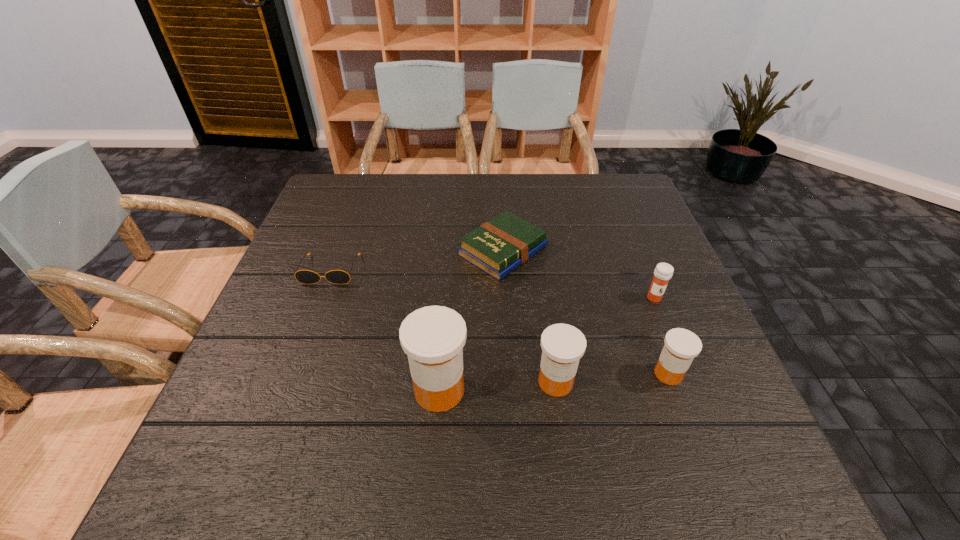
Identify the location of vacant region between the sunglasses and the farthest medicine. [x=492, y=284].

The image size is (960, 540). In order to click on unoccupied position between the tallest object and the book in this screenshot , I will do `click(471, 320)`.

Locate an element on the screen. free spot between the tallest medicine and the book is located at coordinates (471, 320).

Identify the location of empty location between the second tallest medicine and the book. The height and width of the screenshot is (540, 960). (529, 316).

Where is `object that is the third closest to the sunglasses`? The image size is (960, 540). object that is the third closest to the sunglasses is located at coordinates (563, 345).

Find the location of a particular element. object identified as the fourth closest to the book is located at coordinates (303, 276).

Locate an element on the screen. This screenshot has height=540, width=960. medicine that can be found as the closest to the tallest object is located at coordinates (563, 345).

Locate which medicine ranks in proximity to the third farthest object. Please provide its 2D coordinates. Your answer should be formatted as a tuple, i.e. [(x, y)], where the tuple contains the x and y coordinates of a point satisfying the conditions above.

[(681, 346)]

Identify the location of vacant space that satisfies the following two spatial constraints: 1. on the label of the second tallest object; 2. on the label of the leftmost medicine. (557, 390).